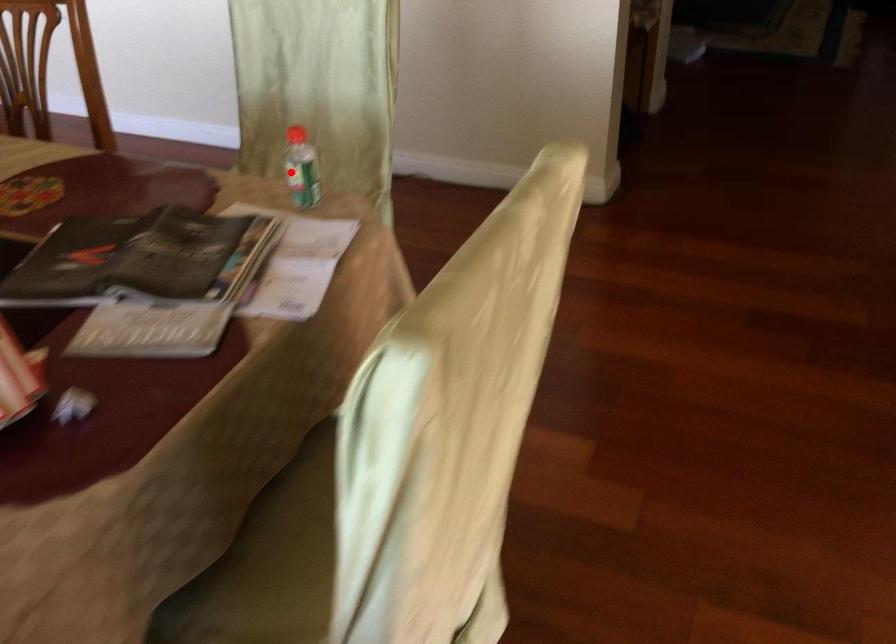
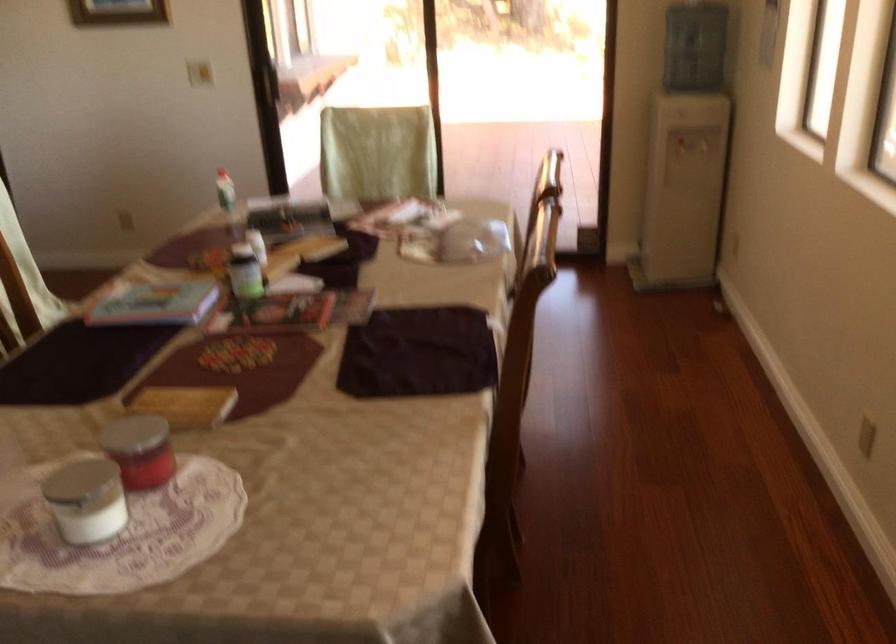
The point at the highlighted location is marked in the first image. Where is the corresponding point in the second image?

(225, 190)